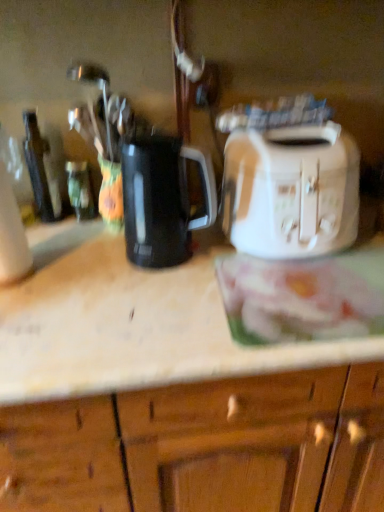
The height and width of the screenshot is (512, 384). I want to click on empty space that is in between black plastic kettle at center and white glossy bread at center, so point(186,290).